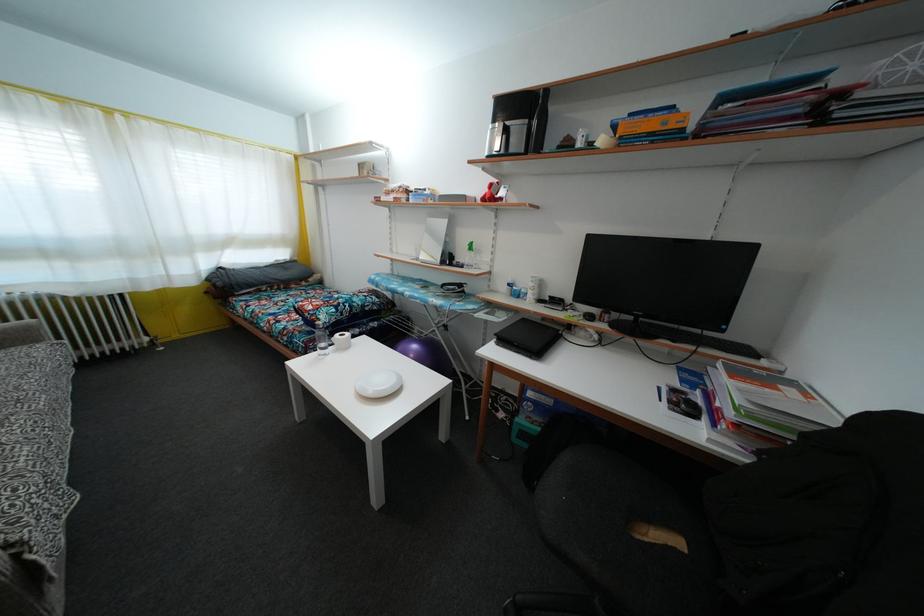
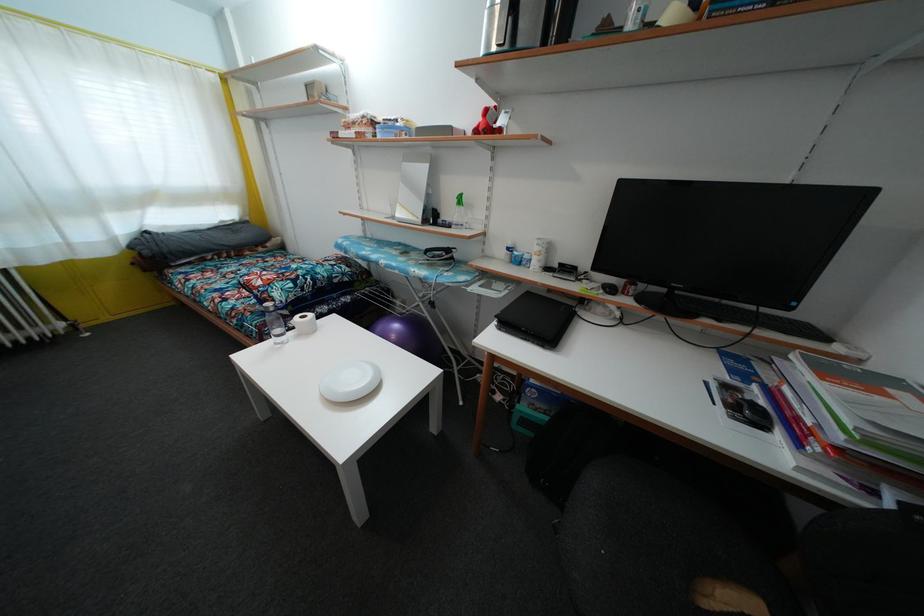
Where in the second image is the point corresponding to (494,132) from the first image?

(492, 10)